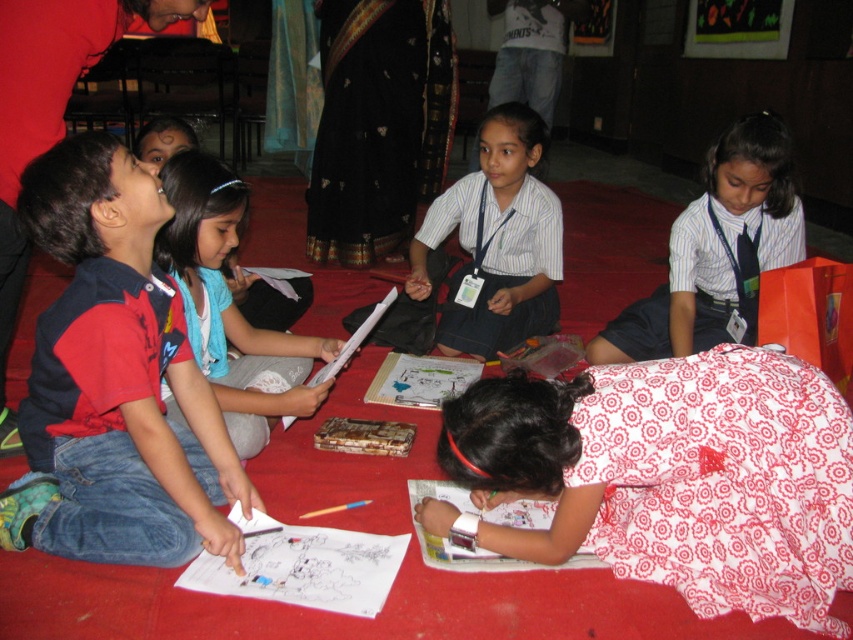
Question: Which point is closer to the camera?

Choices:
 (A) red shirt at left
 (B) white striped shirt at upper center
 (C) white striped shirt at center

Answer: (A)

Question: Is red shirt at left bigger than white striped shirt at upper center?

Choices:
 (A) no
 (B) yes

Answer: (A)

Question: Which of the following is the closest to the observer?

Choices:
 (A) (119, 208)
 (B) (583, 440)
 (C) (706, 168)

Answer: (B)

Question: Among these objects, which one is nearest to the camera?

Choices:
 (A) red shirt at left
 (B) white striped shirt at center

Answer: (A)

Question: Is white dotted dress at lower right further to camera compared to white striped shirt at upper center?

Choices:
 (A) no
 (B) yes

Answer: (A)

Question: Does white dotted dress at lower right have a smaller size compared to light blue scarf at center?

Choices:
 (A) no
 (B) yes

Answer: (B)